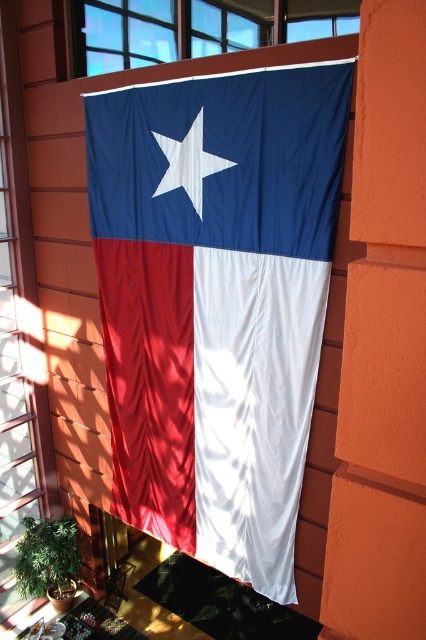
Does matte fabric flag at center have a greater width compared to transparent glass window at upper center?

No, matte fabric flag at center is not wider than transparent glass window at upper center.

Between point (146, 205) and point (316, 1), which one is positioned in front?

Point (316, 1) is in front.

Locate an element on the screen. The width and height of the screenshot is (426, 640). matte fabric flag at center is located at coordinates (215, 301).

Who is positioned more to the right, orange smooth wall at center or transparent glass window at upper center?

orange smooth wall at center is more to the right.

Based on the photo, does orange smooth wall at center have a greater width compared to transparent glass window at upper center?

Incorrect, orange smooth wall at center's width does not surpass transparent glass window at upper center's.

Does point (377, 624) lie behind point (293, 24)?

No, it is not.

Identify the location of orange smooth wall at center. The height and width of the screenshot is (640, 426). (382, 346).

Does transparent glass window at lower left appear on the left side of transparent glass window at upper center?

Indeed, transparent glass window at lower left is positioned on the left side of transparent glass window at upper center.

Is point (13, 326) more distant than point (115, 19)?

Yes, it is behind point (115, 19).

This screenshot has width=426, height=640. Find the location of `transparent glass window at lower left`. transparent glass window at lower left is located at coordinates (19, 337).